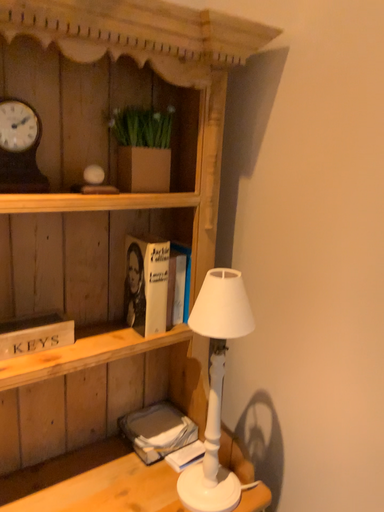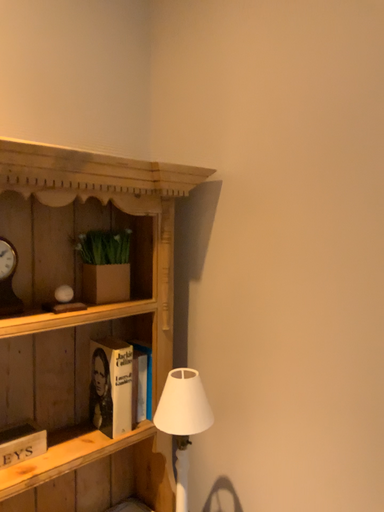
Question: Which way did the camera rotate in the video?

Choices:
 (A) rotated right
 (B) rotated left

Answer: (A)